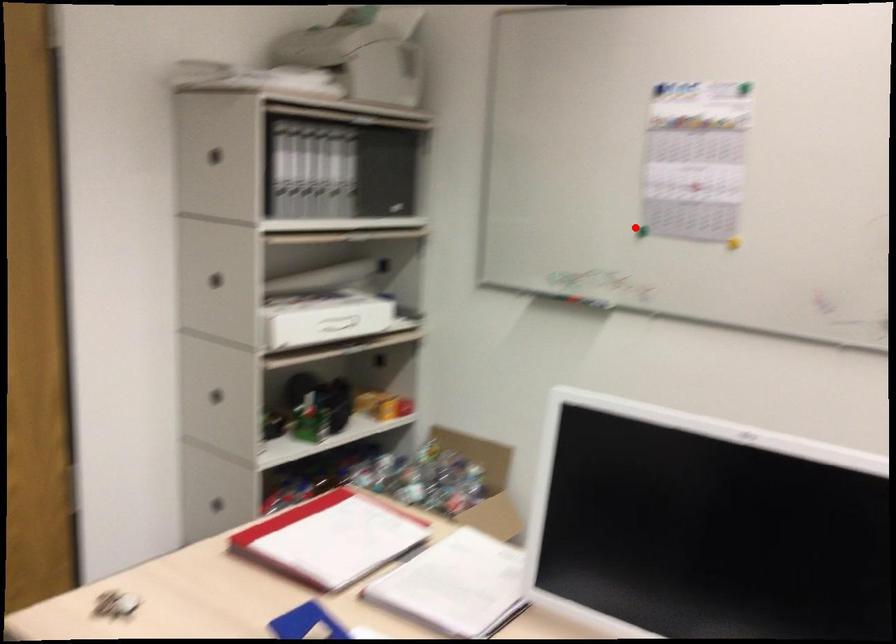
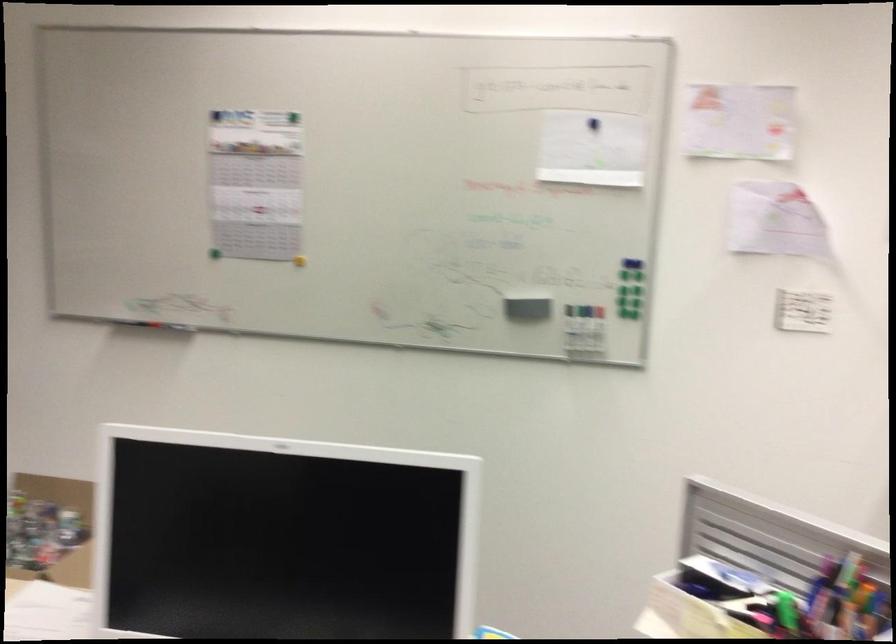
Find the pixel in the second image that matches the highlighted location in the first image.

(213, 252)